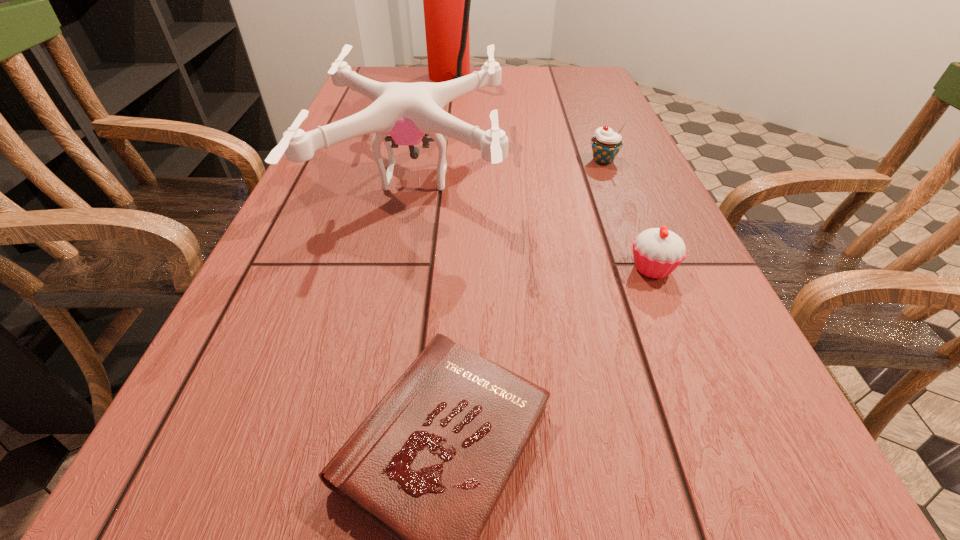
Identify which object is located as the fourth nearest to the nearest object. Please provide its 2D coordinates. Your answer should be formatted as a tuple, i.e. [(x, y)], where the tuple contains the x and y coordinates of a point satisfying the conditions above.

[(446, 0)]

Identify the location of object that is the fourth closest to the third tallest object. This screenshot has height=540, width=960. (428, 465).

This screenshot has width=960, height=540. What are the coordinates of `vacant space that satisfies the following two spatial constraints: 1. on the top of the second tallest object; 2. on the back side of the nearer cupcake` in the screenshot? It's located at (397, 268).

You are a GUI agent. You are given a task and a screenshot of the screen. Output one action in this format:
    pyautogui.click(x=<x>, y=<y>)
    Task: Click on the vacant space that satisfies the following two spatial constraints: 1. on the top of the fourth shortest object; 2. on the left side of the fourth tallest object
    This screenshot has width=960, height=540.
    Given the screenshot: What is the action you would take?
    pyautogui.click(x=397, y=268)

Where is `vacant point that satisfies the following two spatial constraints: 1. on the back side of the nearer cupcake; 2. on the top of the drone`? This screenshot has height=540, width=960. vacant point that satisfies the following two spatial constraints: 1. on the back side of the nearer cupcake; 2. on the top of the drone is located at coordinates (614, 177).

The image size is (960, 540). Identify the location of free space in the image that satisfies the following two spatial constraints: 1. on the back side of the shorter cupcake; 2. on the top of the fourth shortest object. (614, 177).